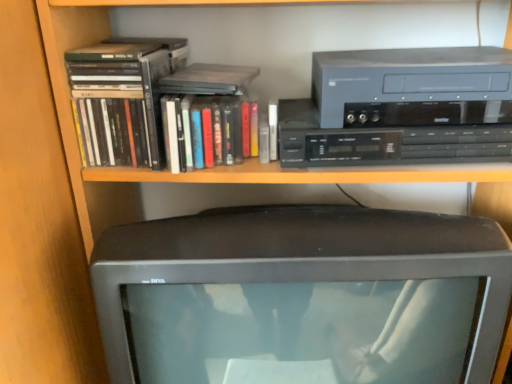
In order to face black plastic cassette at upper right, arranged as the first cassette when ordered from the bottom, should I rotate leftwards or rightwards?

You should rotate right by 18.718 degrees.

Measure the distance between matte black monitor at center and camera.

matte black monitor at center is 62.66 centimeters from camera.

This screenshot has width=512, height=384. What do you see at coordinates (303, 297) in the screenshot?
I see `matte black monitor at center` at bounding box center [303, 297].

Where is `matte gray cassette at upper right, positioned as the second cassette in bottom-to-top order`? The image size is (512, 384). matte gray cassette at upper right, positioned as the second cassette in bottom-to-top order is located at coordinates (408, 77).

This screenshot has height=384, width=512. Identify the location of hardcover book at upper center. (209, 79).

Image resolution: width=512 pixels, height=384 pixels. Find the location of `black plastic cassette at upper right, which is the 2th cassette in top-to-bottom order`. black plastic cassette at upper right, which is the 2th cassette in top-to-bottom order is located at coordinates (395, 134).

Is matte gray cassette at upper right, the first cassette viewed from the top, facing away from black plastic cassette at upper right, which is the 2th cassette in top-to-bottom order?

No, black plastic cassette at upper right, which is the 2th cassette in top-to-bottom order, is not at the back of matte gray cassette at upper right, the first cassette viewed from the top.

Is matte gray cassette at upper right, positioned as the second cassette in bottom-to-top order, not near black plastic cassette at upper right, which is the 2th cassette in top-to-bottom order?

No, there isn't a large distance between matte gray cassette at upper right, positioned as the second cassette in bottom-to-top order, and black plastic cassette at upper right, which is the 2th cassette in top-to-bottom order.

In the scene shown: Which of these two, matte gray cassette at upper right, the first cassette viewed from the top, or black plastic cassette at upper right, which is the 2th cassette in top-to-bottom order, stands shorter?

black plastic cassette at upper right, which is the 2th cassette in top-to-bottom order.

Considering the relative sizes of matte gray cassette at upper right, the first cassette viewed from the top, and black plastic cassette at upper right, which is the 2th cassette in top-to-bottom order, in the image provided, is matte gray cassette at upper right, the first cassette viewed from the top, smaller than black plastic cassette at upper right, which is the 2th cassette in top-to-bottom order,?

No.

From a real-world perspective, is matte black monitor at center beneath hardcover book at center, acting as the second book starting from the left?

Yes, from a real-world perspective, matte black monitor at center is below hardcover book at center, acting as the second book starting from the left.

From the image's perspective, which one is positioned higher, matte black monitor at center or hardcover book at center, which is the first book from right to left?

From the image's view, hardcover book at center, which is the first book from right to left, is above.

Does matte black monitor at center appear on the left side of hardcover book at center, acting as the second book starting from the left?

No.

Between matte black monitor at center and hardcover book at center, acting as the second book starting from the left, which one has more height?

With more height is matte black monitor at center.

Based on their positions, is hardcover book at upper center located to the left or right of matte black book at upper left, the 2th book viewed from the right?

hardcover book at upper center is to the right of matte black book at upper left, the 2th book viewed from the right.

From a real-world perspective, is hardcover book at upper center physically located above or below matte black book at upper left, the 2th book viewed from the right?

Clearly, from a real-world perspective, hardcover book at upper center is above matte black book at upper left, the 2th book viewed from the right.

Is hardcover book at upper center further to camera compared to matte black book at upper left, which ranks as the 1th book in left-to-right order?

No, hardcover book at upper center is closer to the camera.

Based on the photo, is hardcover book at upper center wider than matte black book at upper left, the 2th book viewed from the right?

No, hardcover book at upper center is not wider than matte black book at upper left, the 2th book viewed from the right.

Which of these two, hardcover book at center, acting as the second book starting from the left, or matte gray cassette at upper right, the first cassette viewed from the top, stands shorter?

With less height is matte gray cassette at upper right, the first cassette viewed from the top.

Considering the sizes of objects hardcover book at center, acting as the second book starting from the left, and matte gray cassette at upper right, positioned as the second cassette in bottom-to-top order, in the image provided, who is bigger, hardcover book at center, acting as the second book starting from the left, or matte gray cassette at upper right, positioned as the second cassette in bottom-to-top order,?

matte gray cassette at upper right, positioned as the second cassette in bottom-to-top order, is bigger.

Does hardcover book at center, acting as the second book starting from the left, come behind matte gray cassette at upper right, the first cassette viewed from the top?

Yes.

In the scene shown: Is hardcover book at center, acting as the second book starting from the left, far from matte gray cassette at upper right, positioned as the second cassette in bottom-to-top order?

No.

Is point (202, 80) positioned after point (432, 322)?

Yes.

Considering the relative sizes of hardcover book at upper center and matte black monitor at center in the image provided, is hardcover book at upper center bigger than matte black monitor at center?

No.

Is hardcover book at upper center at the right side of matte black monitor at center?

Incorrect, hardcover book at upper center is not on the right side of matte black monitor at center.

Does matte gray cassette at upper right, the first cassette viewed from the top, have a larger size compared to hardcover book at center, acting as the second book starting from the left?

Yes, matte gray cassette at upper right, the first cassette viewed from the top, is bigger than hardcover book at center, acting as the second book starting from the left.

Is matte gray cassette at upper right, the first cassette viewed from the top, directly adjacent to hardcover book at center, acting as the second book starting from the left?

No, matte gray cassette at upper right, the first cassette viewed from the top, is not with hardcover book at center, acting as the second book starting from the left.

From a real-world perspective, is matte gray cassette at upper right, the first cassette viewed from the top, physically located above or below hardcover book at center, acting as the second book starting from the left?

matte gray cassette at upper right, the first cassette viewed from the top, is above hardcover book at center, acting as the second book starting from the left.

Which object is positioned more to the right, matte black monitor at center or matte black book at upper left, the 2th book viewed from the right?

matte black monitor at center is more to the right.

Is matte black monitor at center beside matte black book at upper left, which ranks as the 1th book in left-to-right order?

No.

Which is in front, matte black monitor at center or matte black book at upper left, the 2th book viewed from the right?

Positioned in front is matte black monitor at center.

Where is `cassette located above the black plastic cassette at upper right, which is the 2th cassette in top-to-bottom order (from the image's perspective)`? The height and width of the screenshot is (384, 512). cassette located above the black plastic cassette at upper right, which is the 2th cassette in top-to-bottom order (from the image's perspective) is located at coordinates (408, 77).

Where is `computer monitor below the hardcover book at center, which is the first book from right to left (from a real-world perspective)`? This screenshot has width=512, height=384. computer monitor below the hardcover book at center, which is the first book from right to left (from a real-world perspective) is located at coordinates (303, 297).

Estimate the real-world distances between objects in this image. Which object is further from matte black monitor at center, matte black book at upper left, the 2th book viewed from the right, or matte gray cassette at upper right, positioned as the second cassette in bottom-to-top order?

Among the two, matte black book at upper left, the 2th book viewed from the right, is located further to matte black monitor at center.

From the image, which object appears to be farther from black plastic cassette at upper right, arranged as the first cassette when ordered from the bottom, hardcover book at upper center or matte black book at upper left, the 2th book viewed from the right?

matte black book at upper left, the 2th book viewed from the right, is positioned further to the anchor black plastic cassette at upper right, arranged as the first cassette when ordered from the bottom.

Estimate the real-world distances between objects in this image. Which object is closer to matte black book at upper left, the 2th book viewed from the right, matte black monitor at center or black plastic cassette at upper right, arranged as the first cassette when ordered from the bottom?

matte black monitor at center lies closer to matte black book at upper left, the 2th book viewed from the right, than the other object.

In the scene shown: Looking at the image, which one is located closer to hardcover book at upper center, hardcover book at center, acting as the second book starting from the left, or matte black book at upper left, which ranks as the 1th book in left-to-right order?

Among the two, hardcover book at center, acting as the second book starting from the left, is located nearer to hardcover book at upper center.

Based on their spatial positions, is black plastic cassette at upper right, arranged as the first cassette when ordered from the bottom, or hardcover book at center, acting as the second book starting from the left, closer to matte black book at upper left, the 2th book viewed from the right?

hardcover book at center, acting as the second book starting from the left, is closer to matte black book at upper left, the 2th book viewed from the right.

Considering their positions, is matte gray cassette at upper right, positioned as the second cassette in bottom-to-top order, positioned further to matte black monitor at center than black plastic cassette at upper right, arranged as the first cassette when ordered from the bottom?

matte gray cassette at upper right, positioned as the second cassette in bottom-to-top order.

Looking at the image, which one is located closer to matte black monitor at center, black plastic cassette at upper right, arranged as the first cassette when ordered from the bottom, or hardcover book at upper center?

black plastic cassette at upper right, arranged as the first cassette when ordered from the bottom, lies closer to matte black monitor at center than the other object.

From the image, which object appears to be farther from hardcover book at center, acting as the second book starting from the left, matte black book at upper left, the 2th book viewed from the right, or hardcover book at upper center?

matte black book at upper left, the 2th book viewed from the right.

Where is `paperback book between matte black book at upper left, the 2th book viewed from the right, and matte gray cassette at upper right, the first cassette viewed from the top, in the horizontal direction`? This screenshot has height=384, width=512. paperback book between matte black book at upper left, the 2th book viewed from the right, and matte gray cassette at upper right, the first cassette viewed from the top, in the horizontal direction is located at coordinates (209, 79).

The width and height of the screenshot is (512, 384). Identify the location of book situated between hardcover book at upper center and black plastic cassette at upper right, arranged as the first cassette when ordered from the bottom, from left to right. (x=207, y=131).

Where is `cassette between matte gray cassette at upper right, the first cassette viewed from the top, and matte black monitor at center, in the vertical direction`? The width and height of the screenshot is (512, 384). cassette between matte gray cassette at upper right, the first cassette viewed from the top, and matte black monitor at center, in the vertical direction is located at coordinates (395, 134).

Locate an element on the screen. Image resolution: width=512 pixels, height=384 pixels. book situated between matte black book at upper left, which ranks as the 1th book in left-to-right order, and black plastic cassette at upper right, arranged as the first cassette when ordered from the bottom, from left to right is located at coordinates (207, 131).